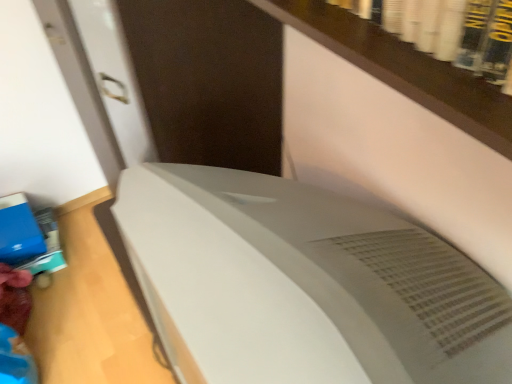
Question: Is blue matte book at lower left inside or outside of satin white air conditioner at center?

Choices:
 (A) inside
 (B) outside

Answer: (B)

Question: Is point (22, 246) closer or farther from the camera than point (416, 271)?

Choices:
 (A) farther
 (B) closer

Answer: (A)

Question: In terms of width, does blue matte book at lower left look wider or thinner when compared to satin white air conditioner at center?

Choices:
 (A) wide
 (B) thin

Answer: (B)

Question: In terms of width, does satin white air conditioner at center look wider or thinner when compared to blue matte book at lower left?

Choices:
 (A) wide
 (B) thin

Answer: (A)

Question: Is satin white air conditioner at center bigger or smaller than blue matte book at lower left?

Choices:
 (A) small
 (B) big

Answer: (B)

Question: Considering their positions, is satin white air conditioner at center located in front of or behind blue matte book at lower left?

Choices:
 (A) behind
 (B) front

Answer: (B)

Question: Considering the relative positions of satin white air conditioner at center and blue matte book at lower left in the image provided, is satin white air conditioner at center to the left or to the right of blue matte book at lower left?

Choices:
 (A) left
 (B) right

Answer: (B)